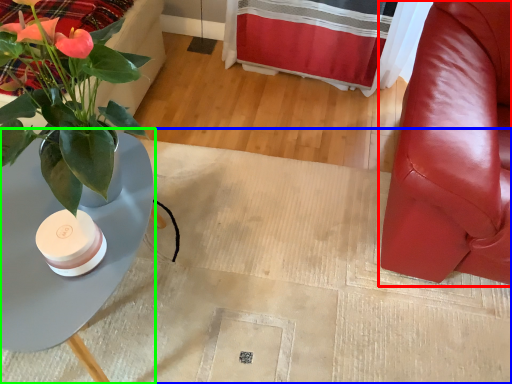
Question: Estimate the real-world distances between objects in this image. Which object is closer to chair (highlighted by a red box), plain (highlighted by a blue box) or table (highlighted by a green box)?

Choices:
 (A) plain
 (B) table

Answer: (A)